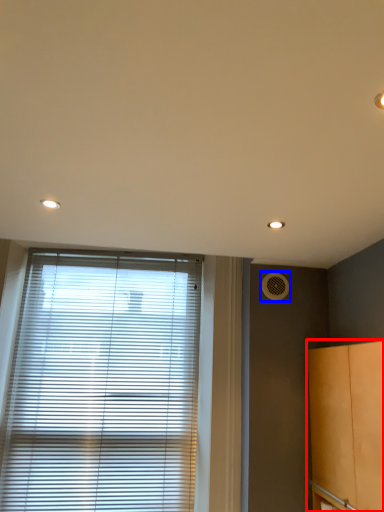
Question: Among these objects, which one is farthest to the camera, cabinetry (highlighted by a red box) or air conditioning (highlighted by a blue box)?

Choices:
 (A) cabinetry
 (B) air conditioning

Answer: (B)